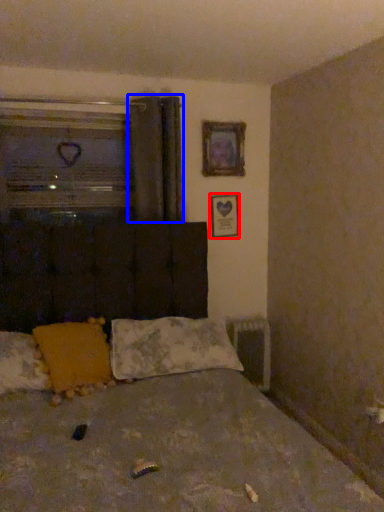
Question: Which object is further to the camera taking this photo, picture frame (highlighted by a red box) or curtain (highlighted by a blue box)?

Choices:
 (A) picture frame
 (B) curtain

Answer: (A)